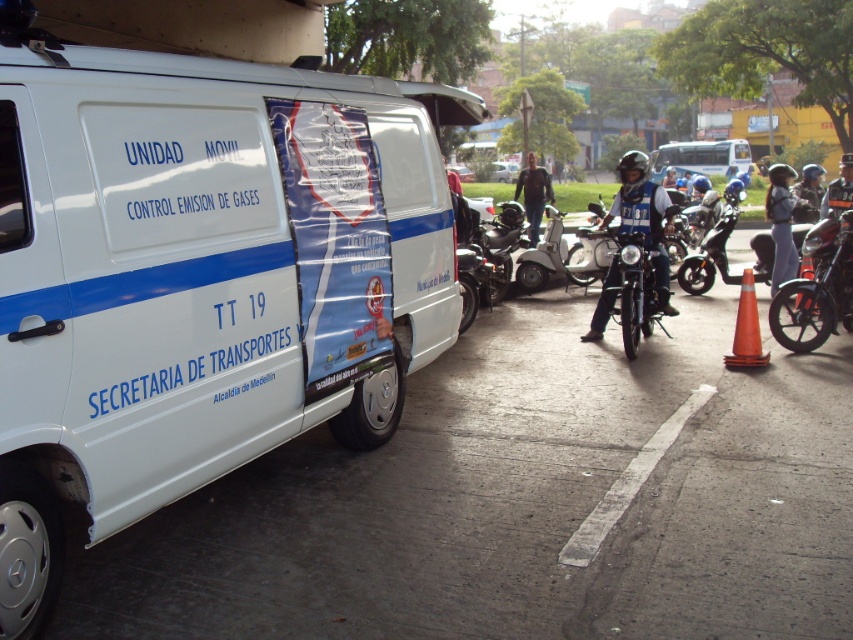
Question: Which point appears closest to the camera in this image?

Choices:
 (A) (328, 182)
 (B) (726, 193)
 (C) (785, 260)
 (D) (734, 330)

Answer: (A)

Question: Which point is closer to the camera?

Choices:
 (A) shiny chrome motorcycle at center
 (B) blue uniform at center
 (C) denim jacket at center

Answer: (B)

Question: Which of the following is the closest to the observer?

Choices:
 (A) [654, 436]
 (B) [724, 364]

Answer: (A)

Question: Can you confirm if orange matte traffic cone at lower right is positioned to the left of metallic helmet at center?

Choices:
 (A) yes
 (B) no

Answer: (A)

Question: Does shiny black motorcycle at right appear under shiny black motorcycle at center?

Choices:
 (A) no
 (B) yes

Answer: (B)

Question: Considering the relative positions of shiny black motorcycle at center and orange matte traffic cone at lower right in the image provided, where is shiny black motorcycle at center located with respect to orange matte traffic cone at lower right?

Choices:
 (A) below
 (B) above

Answer: (B)